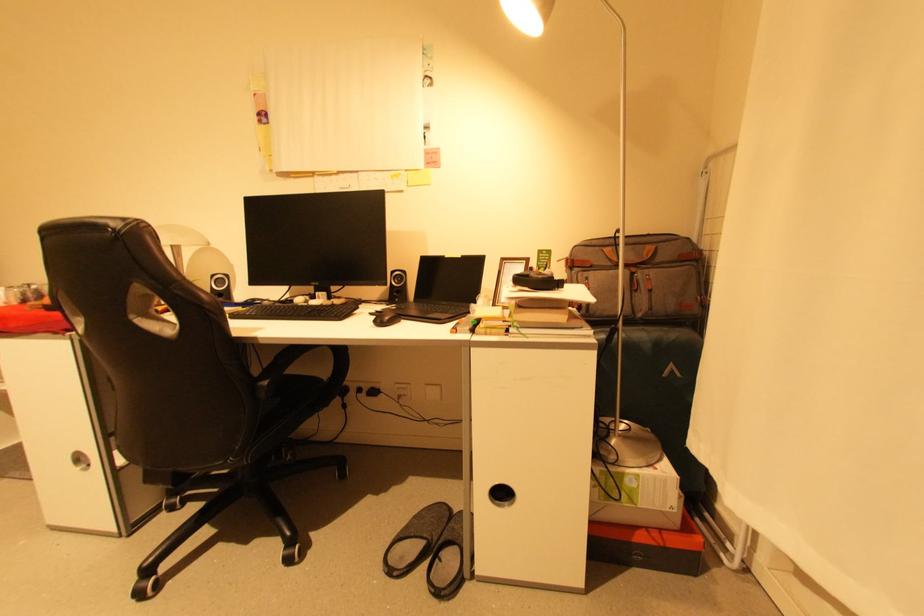
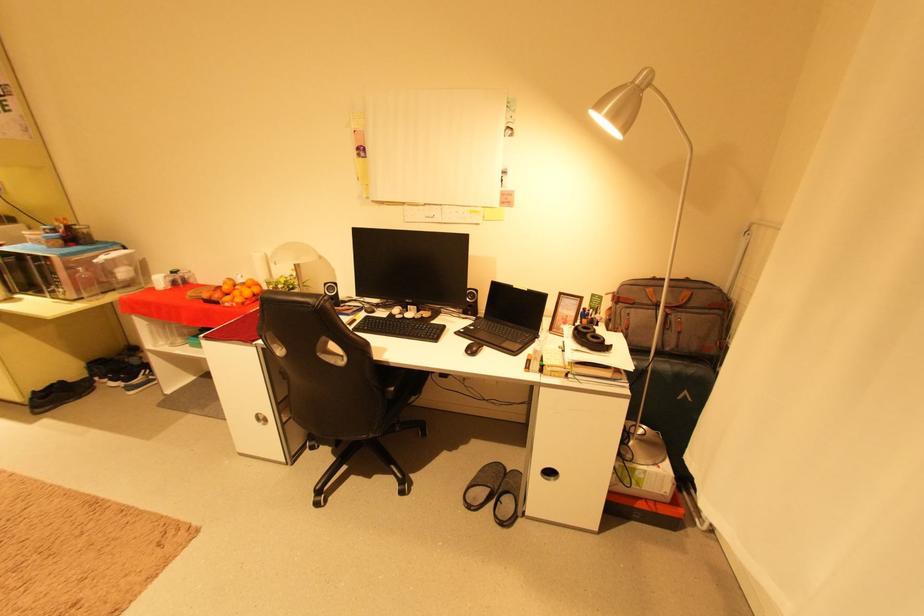
Locate, in the second image, the point that corresponds to (x=404, y=282) in the first image.

(477, 298)